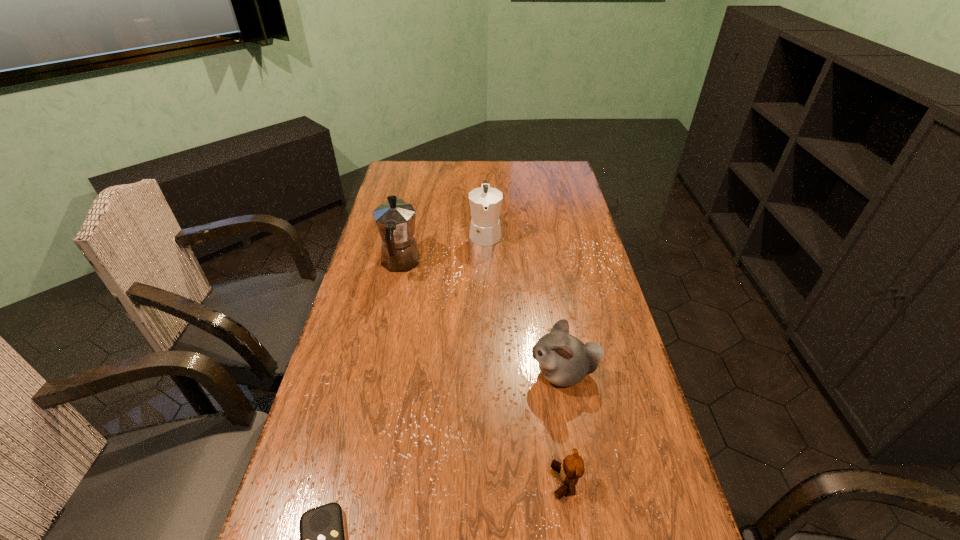
This screenshot has height=540, width=960. What are the coordinates of `the tallest object` in the screenshot? It's located at (395, 220).

I want to click on the left coffeepot, so click(395, 220).

Identify the location of the second tallest object. The width and height of the screenshot is (960, 540). coord(485,202).

What are the coordinates of `the shorter coffeepot` in the screenshot? It's located at (485, 202).

Image resolution: width=960 pixels, height=540 pixels. I want to click on the third tallest object, so click(x=564, y=360).

At what (x,y) coordinates should I click in order to perform the action: click on hamster. Please return your answer as a coordinate pair (x, y). The image size is (960, 540). Looking at the image, I should click on (564, 360).

Where is `the fourth farthest object`? Image resolution: width=960 pixels, height=540 pixels. the fourth farthest object is located at coordinates (572, 468).

The height and width of the screenshot is (540, 960). I want to click on the second shortest object, so pos(572,468).

Locate an element on the screen. This screenshot has width=960, height=540. vacant space situated 0.270m on the pouring side of the left coffeepot is located at coordinates (413, 204).

Locate an element on the screen. free space located on the pouring side of the left coffeepot is located at coordinates (410, 218).